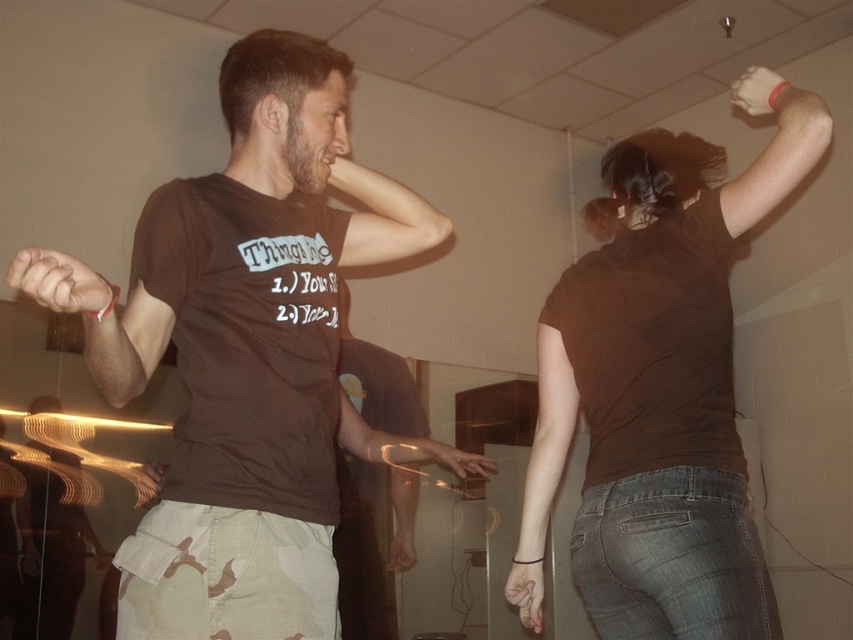
Can you confirm if brown cotton t-shirt at left is thinner than brown matte shirt at upper right?

Yes, brown cotton t-shirt at left is thinner than brown matte shirt at upper right.

This screenshot has width=853, height=640. In order to click on brown cotton t-shirt at left in this screenshot , I will do `click(247, 353)`.

Image resolution: width=853 pixels, height=640 pixels. What are the coordinates of `brown cotton t-shirt at left` in the screenshot? It's located at (247, 353).